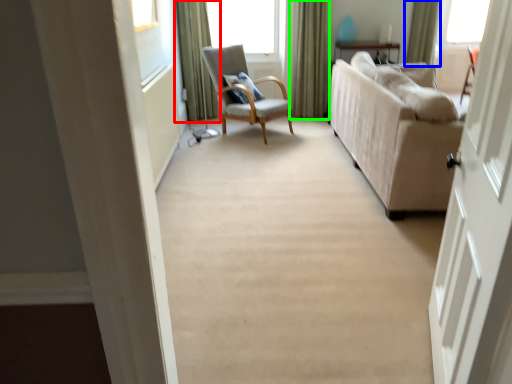
Question: Which object is positioned farthest from curtain (highlighted by a red box)? Select from curtain (highlighted by a blue box) and curtain (highlighted by a green box).

Choices:
 (A) curtain
 (B) curtain

Answer: (A)